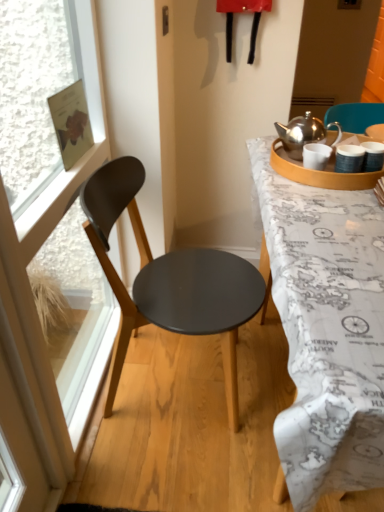
Question: From a real-world perspective, is matte black chair at left positioned above or below transparent glass window at left?

Choices:
 (A) below
 (B) above

Answer: (A)

Question: In terms of size, does matte black chair at left appear bigger or smaller than transparent glass window at left?

Choices:
 (A) big
 (B) small

Answer: (A)

Question: Estimate the real-world distances between objects in this image. Which object is closer to the white matte coffee cup at upper right?

Choices:
 (A) white map-covered desk at right
 (B) matte black chair at left
 (C) transparent glass window at left

Answer: (A)

Question: Which object is positioned farthest from the matte black chair at left?

Choices:
 (A) white map-covered desk at right
 (B) white matte coffee cup at upper right
 (C) transparent glass window at left

Answer: (B)